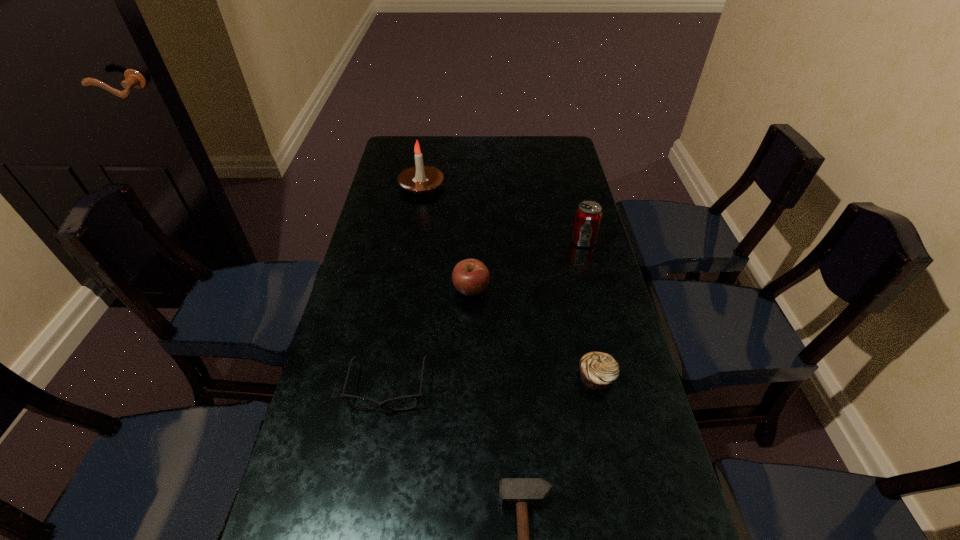
Locate an element on the screen. vacant space at the far left corner is located at coordinates (398, 144).

Where is `free space between the spectacles and the second tallest object`? Image resolution: width=960 pixels, height=540 pixels. free space between the spectacles and the second tallest object is located at coordinates (486, 314).

At what (x,y) coordinates should I click in order to perform the action: click on free space between the fourth tallest object and the candle. Please return your answer as a coordinate pair (x, y). Looking at the image, I should click on (509, 281).

At what (x,y) coordinates should I click in order to perform the action: click on empty location between the farthest object and the fourth nearest object. Please return your answer as a coordinate pair (x, y). The width and height of the screenshot is (960, 540). Looking at the image, I should click on (446, 238).

Identify the location of unoccupied position between the pop soda and the candle. (502, 213).

You are a GUI agent. You are given a task and a screenshot of the screen. Output one action in this format:
    pyautogui.click(x=<x>, y=<y>)
    Task: Click on the vacant space in between the muffin and the spectacles
    The height and width of the screenshot is (540, 960).
    Given the screenshot: What is the action you would take?
    pyautogui.click(x=492, y=382)

The height and width of the screenshot is (540, 960). I want to click on vacant space that's between the third shortest object and the tallest object, so [509, 281].

Select which object appears as the fifth closest to the spectacles. Please provide its 2D coordinates. Your answer should be formatted as a tuple, i.e. [(x, y)], where the tuple contains the x and y coordinates of a point satisfying the conditions above.

[(420, 179)]

Locate which object ranks in proximity to the fifth shortest object. Please provide its 2D coordinates. Your answer should be formatted as a tuple, i.e. [(x, y)], where the tuple contains the x and y coordinates of a point satisfying the conditions above.

[(470, 277)]

At what (x,y) coordinates should I click in order to perform the action: click on free space that satisfies the following two spatial constraints: 1. on the front side of the tallest object; 2. on the right side of the fourth tallest object. Please return your answer as a coordinate pair (x, y). This screenshot has height=540, width=960. Looking at the image, I should click on (390, 377).